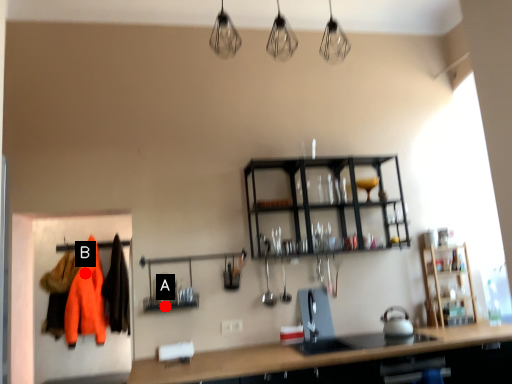
Question: Two points are circled on the image, labeled by A and B beside each circle. Which point appears farthest from the camera in this image?

Choices:
 (A) A is further
 (B) B is further

Answer: (B)